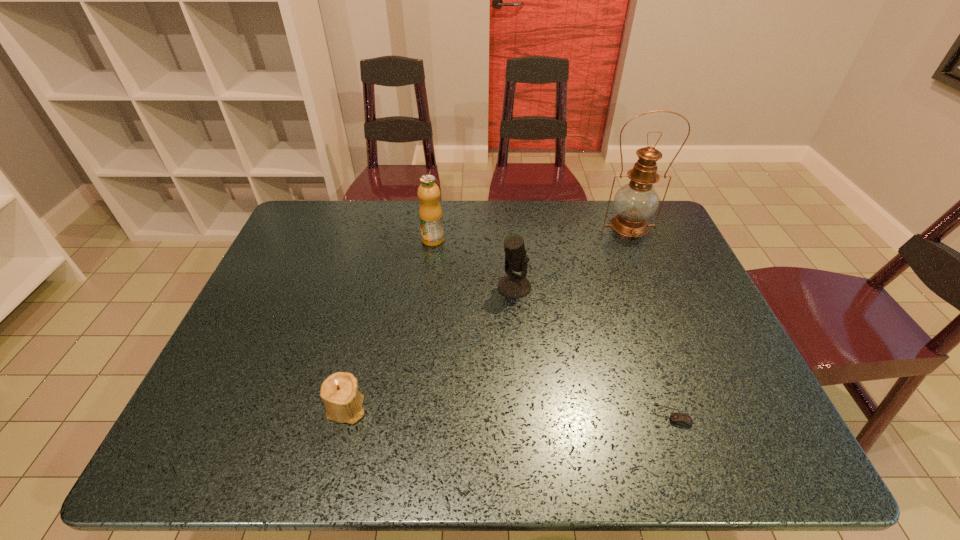
Find the location of a particular element. The height and width of the screenshot is (540, 960). the tallest object is located at coordinates (635, 202).

You are a GUI agent. You are given a task and a screenshot of the screen. Output one action in this format:
    pyautogui.click(x=<x>, y=<y>)
    Task: Click on the fruit juice
    
    Given the screenshot: What is the action you would take?
    pyautogui.click(x=430, y=212)

Where is `the fourth object from right to left`? the fourth object from right to left is located at coordinates (x=430, y=212).

This screenshot has width=960, height=540. What are the coordinates of `the third tallest object` in the screenshot? It's located at (512, 285).

Where is `the third farthest object`? The image size is (960, 540). the third farthest object is located at coordinates (512, 285).

Where is `the leftmost object`? The image size is (960, 540). the leftmost object is located at coordinates (343, 402).

Locate an element on the screen. The image size is (960, 540). candle_holder is located at coordinates (343, 402).

Locate an element on the screen. the shortest object is located at coordinates (677, 418).

Find the location of a particular element. This screenshot has width=960, height=540. vacant space located 0.330m on the front of the tallest object is located at coordinates (x=667, y=317).

Find the location of a particular element. The image size is (960, 540). free space located 0.380m on the front label of the fruit juice is located at coordinates (420, 345).